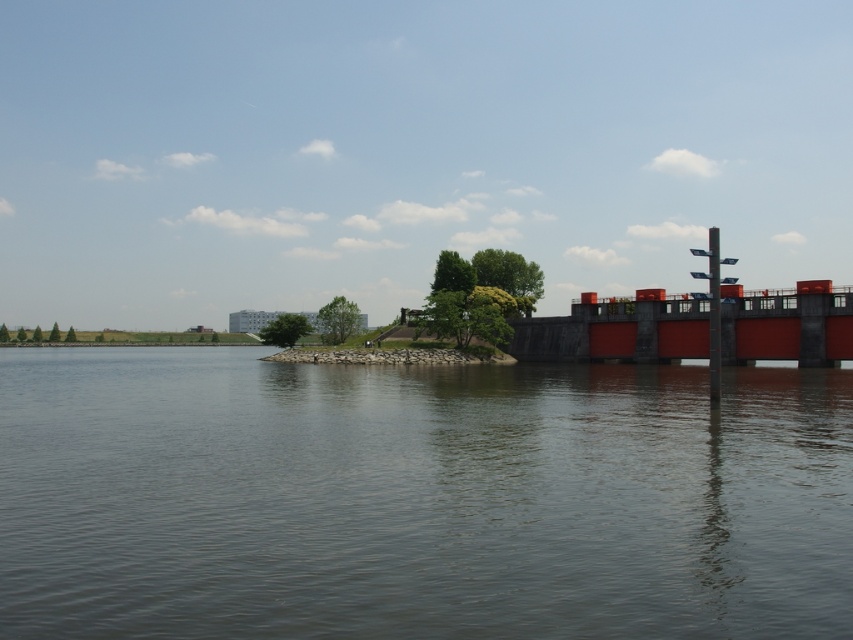
Question: Can you confirm if smooth water at center is positioned to the left of matte red bridge at right?

Choices:
 (A) no
 (B) yes

Answer: (B)

Question: Is smooth water at center to the right of matte red bridge at right from the viewer's perspective?

Choices:
 (A) no
 (B) yes

Answer: (A)

Question: Is smooth water at center to the right of matte red bridge at right from the viewer's perspective?

Choices:
 (A) yes
 (B) no

Answer: (B)

Question: Which of the following is the farthest from the observer?

Choices:
 (A) matte red bridge at right
 (B) smooth water at center

Answer: (A)

Question: Which of the following is the closest to the observer?

Choices:
 (A) (795, 468)
 (B) (601, 312)

Answer: (A)